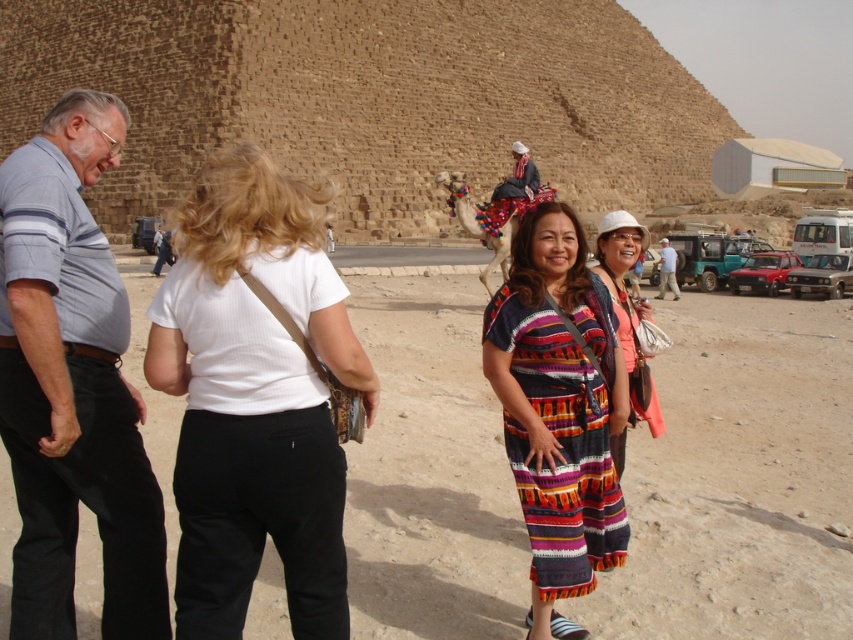
Question: Which is farther from the multicolored woven dress at center?

Choices:
 (A) white cotton shirt at center
 (B) gray striped shirt at left

Answer: (B)

Question: Which object is positioned farthest from the multicolored woven dress at center?

Choices:
 (A) white cotton shirt at center
 (B) brown stone pyramid at upper center
 (C) gray striped shirt at left
 (D) light blue denim shirt at center

Answer: (B)

Question: Which point appears closest to the camera in this image?

Choices:
 (A) (323, 28)
 (B) (27, 637)

Answer: (B)

Question: Is multicolored woven dress at center further to the viewer compared to white woven hat at center?

Choices:
 (A) no
 (B) yes

Answer: (A)

Question: Is brown stone pyramid at upper center below white woven hat at center?

Choices:
 (A) yes
 (B) no

Answer: (B)

Question: Is brown stone pyramid at upper center above white woven hat at center?

Choices:
 (A) no
 (B) yes

Answer: (B)